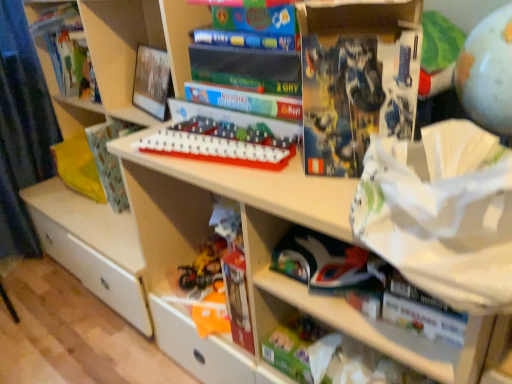
Where is `vacant space in front of blue matte book at upper center, marked as the 1th paperback book in a front-to-back arrangement`? Image resolution: width=512 pixels, height=384 pixels. vacant space in front of blue matte book at upper center, marked as the 1th paperback book in a front-to-back arrangement is located at coordinates (332, 196).